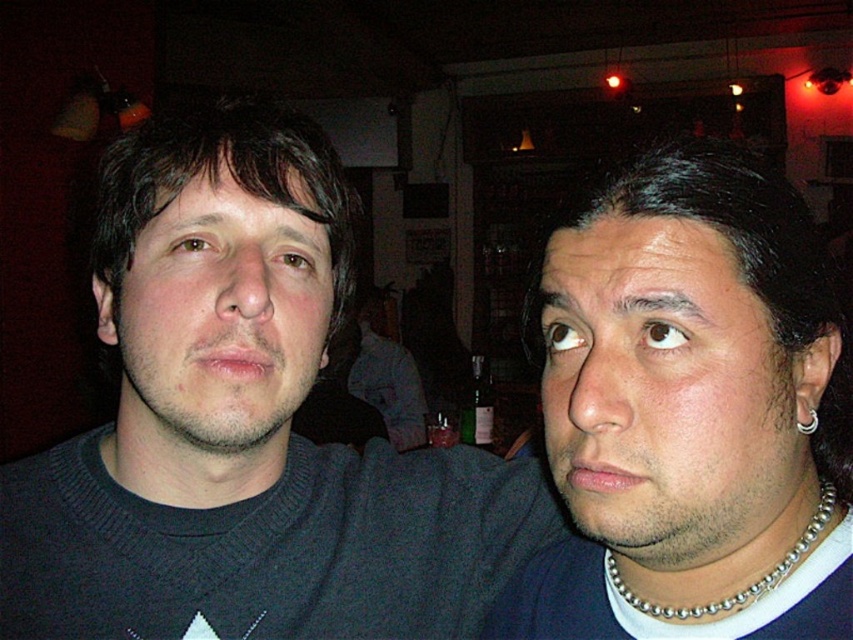
Is dark gray sweater at center taller than silver metallic ring at right ear?

Indeed, dark gray sweater at center has a greater height compared to silver metallic ring at right ear.

Between point (252, 307) and point (802, 429), which one is positioned behind?

The point (802, 429) is behind.

Between point (209, 545) and point (809, 410), which one is positioned behind?

Positioned behind is point (209, 545).

You are a GUI agent. You are given a task and a screenshot of the screen. Output one action in this format:
    pyautogui.click(x=<x>, y=<y>)
    Task: Click on the dark gray sweater at center
    
    Given the screenshot: What is the action you would take?
    pyautogui.click(x=242, y=426)

Who is positioned more to the left, dark gray sweater at center or silver metallic chain at lower right?

Positioned to the left is dark gray sweater at center.

Does dark gray sweater at center have a larger size compared to silver metallic chain at lower right?

Indeed, dark gray sweater at center has a larger size compared to silver metallic chain at lower right.

Between point (341, 618) and point (624, 598), which one is positioned in front?

Point (624, 598) is more forward.

Where is `dark gray sweater at center`? The image size is (853, 640). dark gray sweater at center is located at coordinates (242, 426).

Who is more distant from viewer, (311, 490) or (706, 236)?

Positioned behind is point (311, 490).

Who is lower down, dark gray sweater at center or smooth skin face at right?

dark gray sweater at center is lower down.

Is point (276, 273) closer to viewer compared to point (573, 262)?

No.

You are a GUI agent. You are given a task and a screenshot of the screen. Output one action in this format:
    pyautogui.click(x=<x>, y=<y>)
    Task: Click on the dark gray sweater at center
    This screenshot has width=853, height=640.
    Given the screenshot: What is the action you would take?
    pyautogui.click(x=242, y=426)